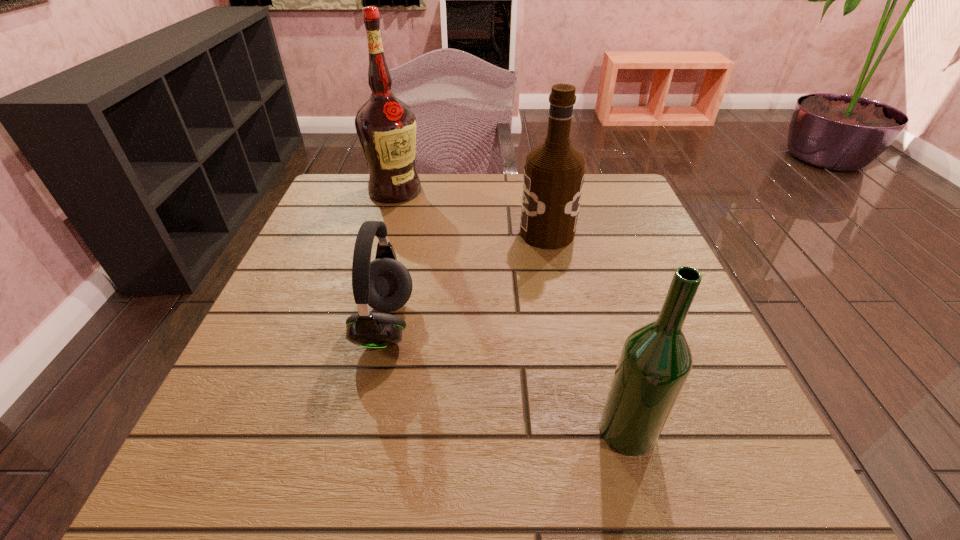
Identify the location of vacant space located on the left of the nearest object. This screenshot has width=960, height=540. (558, 430).

At what (x,y) coordinates should I click in order to perform the action: click on vacant position located on the ear cups of the second nearest object. Please return your answer as a coordinate pair (x, y). Looking at the image, I should click on (590, 325).

Where is `object at the near edge`? object at the near edge is located at coordinates (655, 362).

Where is `object located in the left edge section of the desktop`? This screenshot has height=540, width=960. object located in the left edge section of the desktop is located at coordinates (386, 127).

Locate an element on the screen. This screenshot has width=960, height=540. object located in the right edge section of the desktop is located at coordinates (655, 362).

Identify the location of object that is positioned at the far left corner. (386, 127).

The height and width of the screenshot is (540, 960). I want to click on object positioned at the near right corner, so click(x=655, y=362).

I want to click on vacant space at the far edge of the desktop, so click(420, 213).

Where is `free space at the left edge`? free space at the left edge is located at coordinates (280, 313).

At what (x,y) coordinates should I click in order to perform the action: click on vacant space at the right edge of the desktop. Please return your answer as a coordinate pair (x, y). Looking at the image, I should click on (600, 283).